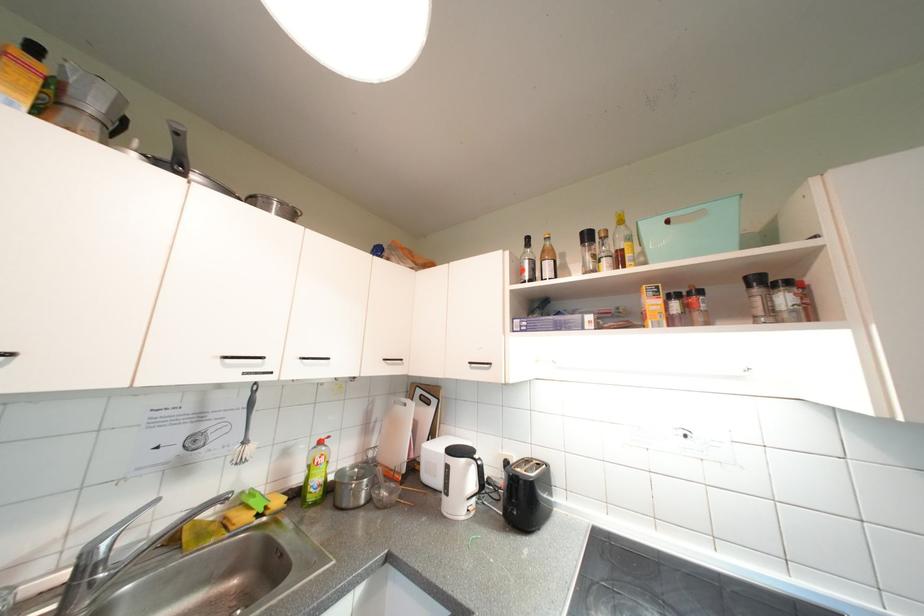
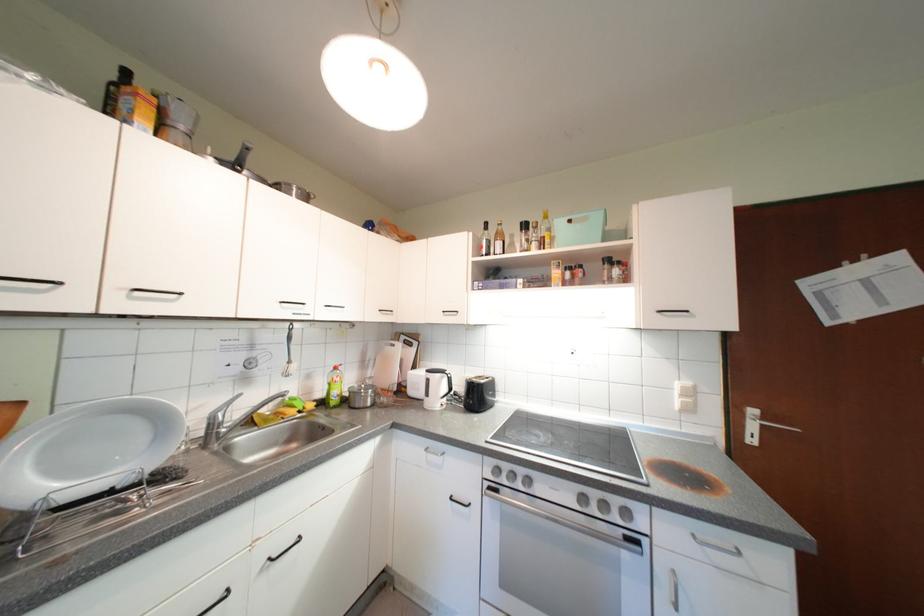
Locate, in the second image, the point that corresponds to [637,257] in the first image.

(554, 243)